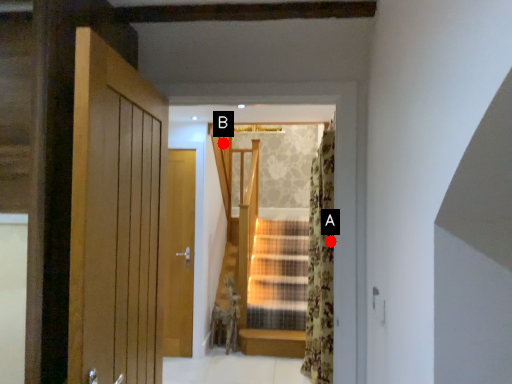
Question: Two points are circled on the image, labeled by A and B beside each circle. Which of the following is the farthest from the observer?

Choices:
 (A) A is further
 (B) B is further

Answer: (B)